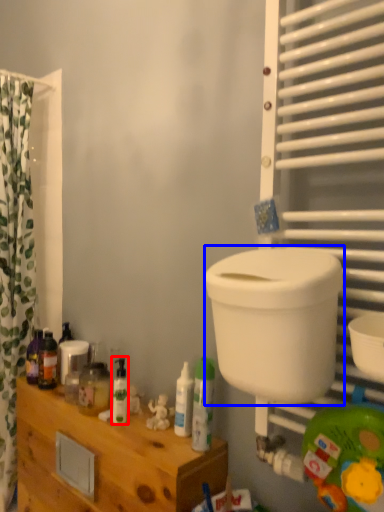
Question: Which object appears closest to the camera in this image, toiletry (highlighted by a red box) or toilet bowl (highlighted by a blue box)?

Choices:
 (A) toiletry
 (B) toilet bowl

Answer: (B)